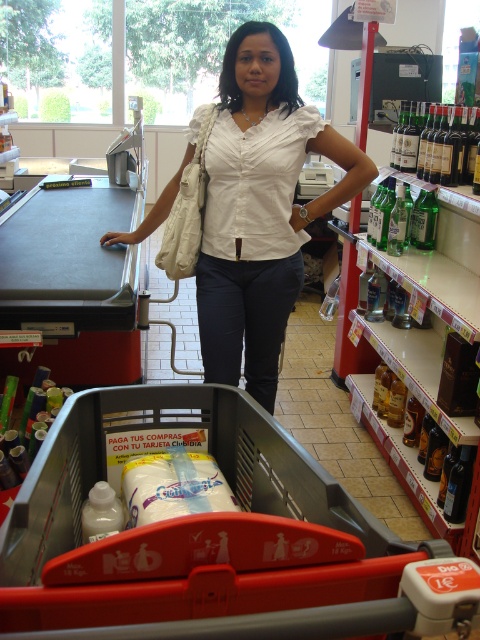
You are a customer in the store and want to pick up the green glass bottles at upper right from the shelf. Can you reach them while standing next to the red plastic shopping cart at center?

The red plastic shopping cart at center is positioned under green glass bottles at upper right, so standing next to the cart would place you directly beneath the bottles, making them easily reachable.

Consider the image. You are a customer in the store and want to grab a bottle of water. There are two sets of green glass bottles labeled as green glass bottles at right and green glass bottles at upper right. Which one is closer to you?

The green glass bottles at right is closer to you since the green glass bottles at upper right is behind it.